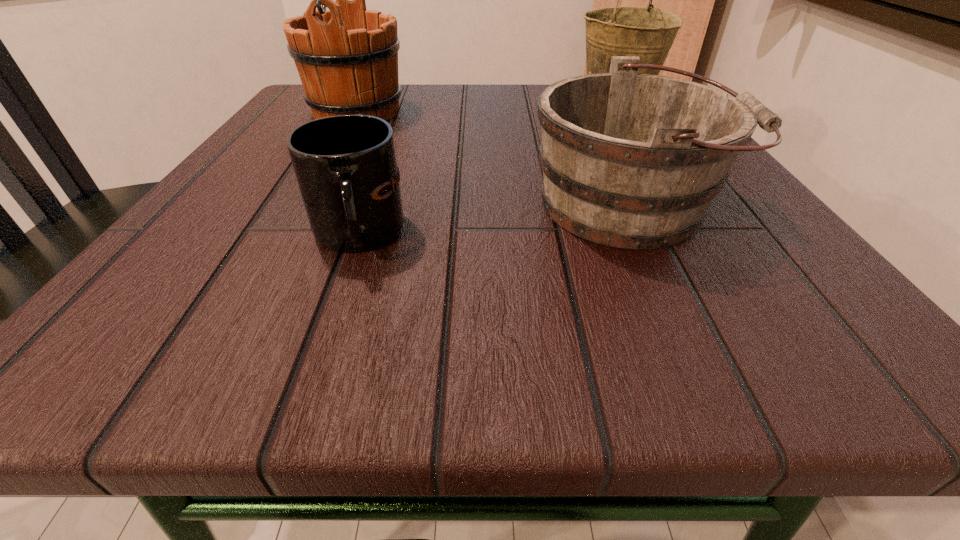
Where is `free space that is in between the second tallest wine bucket and the tallest wine bucket`? free space that is in between the second tallest wine bucket and the tallest wine bucket is located at coordinates (487, 106).

You are a GUI agent. You are given a task and a screenshot of the screen. Output one action in this format:
    pyautogui.click(x=<x>, y=<y>)
    Task: Click on the vacant space in between the mug and the nearest wine bucket
    The width and height of the screenshot is (960, 540).
    Given the screenshot: What is the action you would take?
    pyautogui.click(x=492, y=220)

Where is `the third closest object relative to the shortest wine bucket`? the third closest object relative to the shortest wine bucket is located at coordinates (347, 57).

Locate an element on the screen. This screenshot has height=540, width=960. the third closest object relative to the second shortest wine bucket is located at coordinates (345, 165).

Locate which wine bucket is the second closest to the tallest object. Please provide its 2D coordinates. Your answer should be formatted as a tuple, i.e. [(x, y)], where the tuple contains the x and y coordinates of a point satisfying the conditions above.

[(646, 32)]

Select which wine bucket is the second closest to the third tallest object. Please provide its 2D coordinates. Your answer should be formatted as a tuple, i.e. [(x, y)], where the tuple contains the x and y coordinates of a point satisfying the conditions above.

[(347, 57)]

This screenshot has height=540, width=960. What are the coordinates of `vacant space that satisfies the following two spatial constraints: 1. on the back side of the second shortest wine bucket; 2. on the left side of the third tallest object` in the screenshot? It's located at (578, 99).